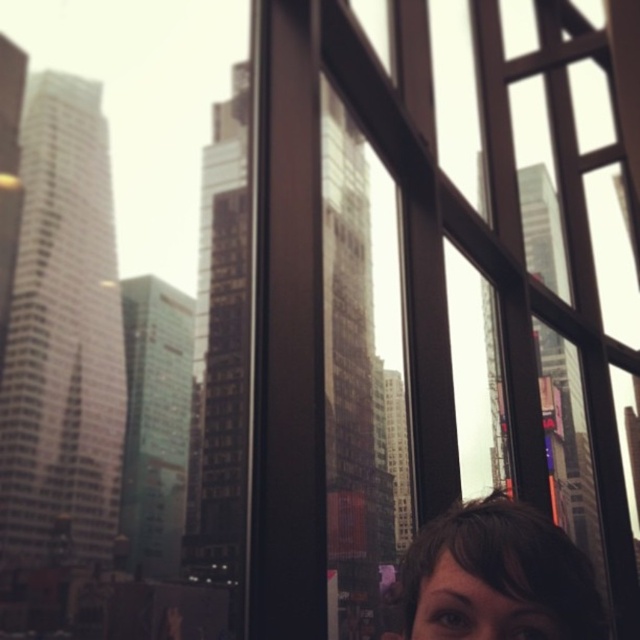
Is transparent glass window at center shorter than brown hair at lower right?

Incorrect, transparent glass window at center's height does not fall short of brown hair at lower right's.

Consider the image. Is transparent glass window at center below brown hair at lower right?

No.

Which is behind, point (273, 19) or point (560, 616)?

Positioned behind is point (273, 19).

In order to click on transparent glass window at center in this screenshot , I will do `click(413, 280)`.